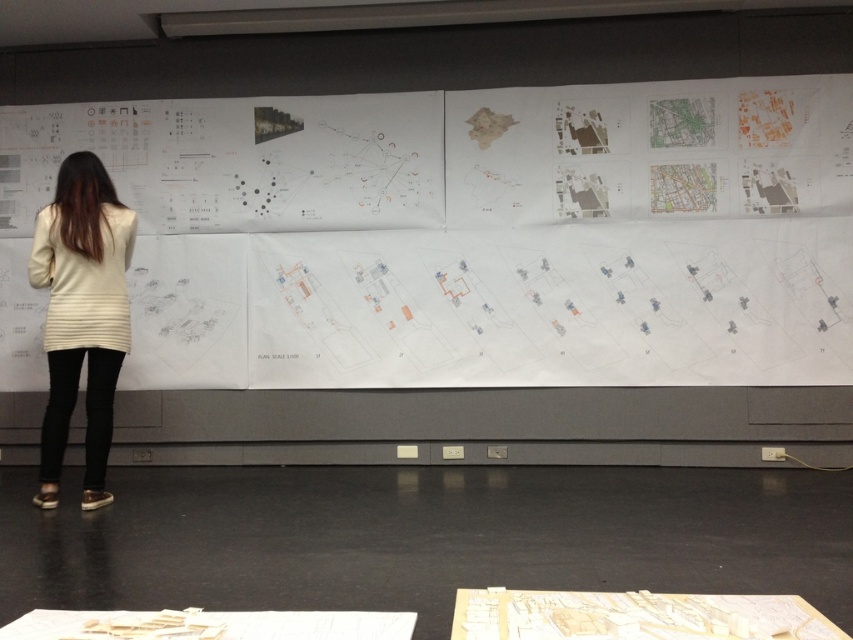
You are an architect reviewing the wall display. You notice the white paper at upper center and the creamy beige sweater at left. Which object is positioned higher on the wall?

The white paper at upper center is located above the creamy beige sweater at left, so it is positioned higher on the wall.

You are an architect standing at the center of the room. You need to locate the white paper at upper center. What are its coordinates?

The coordinates of the white paper at upper center are at point (463, 236).